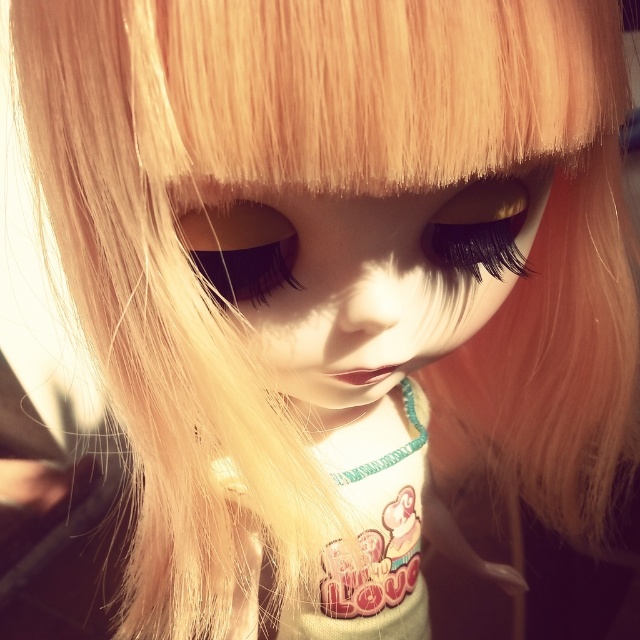
Question: In this image, where is satin blonde hair at center located relative to black matte eyelashes at upper center?

Choices:
 (A) below
 (B) above

Answer: (A)

Question: Does satin blonde hair at center appear on the left side of satin black eye at center?

Choices:
 (A) yes
 (B) no

Answer: (B)

Question: Which object is positioned farthest from the satin black eye at center?

Choices:
 (A) black matte eyelashes at upper center
 (B) satin blonde hair at center

Answer: (A)

Question: Which point is closer to the camera?

Choices:
 (A) (506, 189)
 (B) (289, 284)
 (C) (406, 257)

Answer: (B)

Question: Which point is farther to the camera?

Choices:
 (A) (467, 330)
 (B) (204, 221)
 (C) (483, 208)

Answer: (A)

Question: Does satin blonde hair at center have a lesser width compared to satin black eye at center?

Choices:
 (A) yes
 (B) no

Answer: (B)